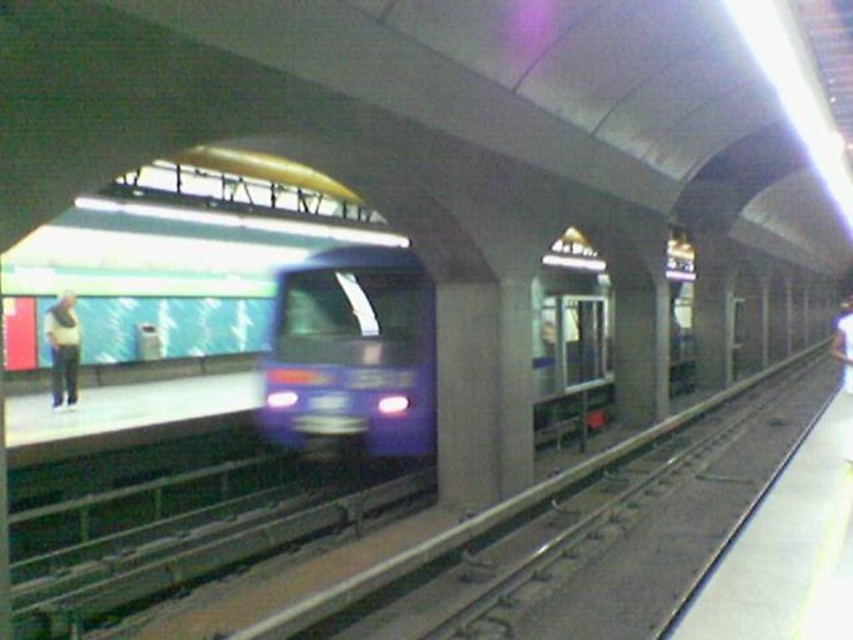
Question: Is light brown leather jacket at left positioned behind white matte shirt at center?

Choices:
 (A) yes
 (B) no

Answer: (A)

Question: Is blue glossy train at center below light brown leather jacket at left?

Choices:
 (A) no
 (B) yes

Answer: (B)

Question: Is light brown leather jacket at left thinner than white matte shirt at center?

Choices:
 (A) no
 (B) yes

Answer: (B)

Question: Estimate the real-world distances between objects in this image. Which object is farther from the light brown leather jacket at left?

Choices:
 (A) blue glossy train at center
 (B) white matte shirt at center

Answer: (B)

Question: Among these points, which one is farthest from the camera?

Choices:
 (A) (283, 410)
 (B) (71, 355)
 (C) (840, 352)

Answer: (B)

Question: Which object is positioned farthest from the white matte shirt at center?

Choices:
 (A) light brown leather jacket at left
 (B) blue glossy train at center

Answer: (A)